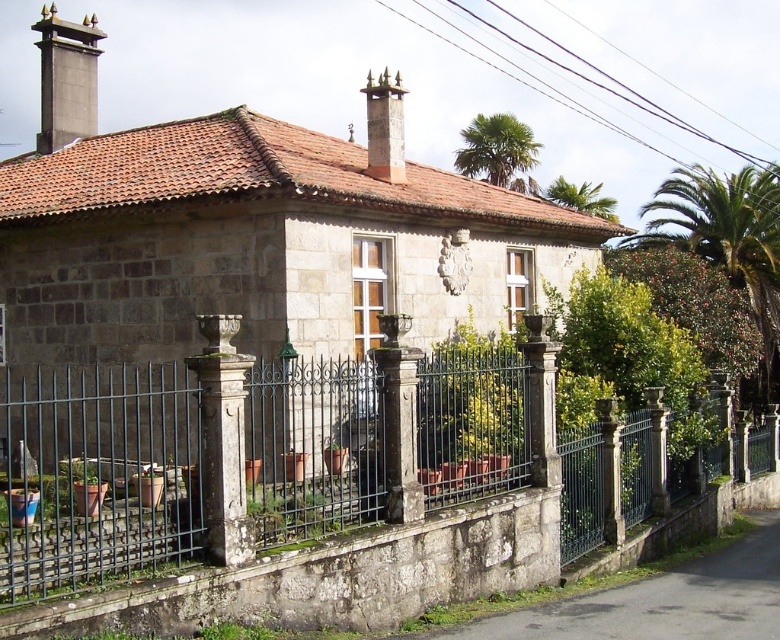
Between point (660, 232) and point (571, 195), which one is positioned behind?

The point (571, 195) is behind.

The height and width of the screenshot is (640, 780). Describe the element at coordinates (727, 243) in the screenshot. I see `green leafy palm at upper right` at that location.

Which is in front, point (773, 390) or point (597, 198)?

Point (773, 390) is more forward.

Where is `green leafy palm at upper right`? The width and height of the screenshot is (780, 640). green leafy palm at upper right is located at coordinates (727, 243).

Which is above, green leafy palm at upper right or smooth gray chimney at upper left?

smooth gray chimney at upper left

Between point (718, 189) and point (48, 35), which one is positioned behind?

Point (718, 189)

At what (x,y) coordinates should I click in order to perform the action: click on green leafy palm at upper right. Please return your answer as a coordinate pair (x, y). Looking at the image, I should click on (727, 243).

Which is more to the left, green wrought iron fence at center or smooth gray chimney at upper center?

From the viewer's perspective, smooth gray chimney at upper center appears more on the left side.

Can you confirm if green wrought iron fence at center is bigger than smooth gray chimney at upper center?

Yes.

This screenshot has height=640, width=780. What do you see at coordinates (100, 476) in the screenshot?
I see `green wrought iron fence at center` at bounding box center [100, 476].

The height and width of the screenshot is (640, 780). What are the coordinates of `green wrought iron fence at center` in the screenshot? It's located at (100, 476).